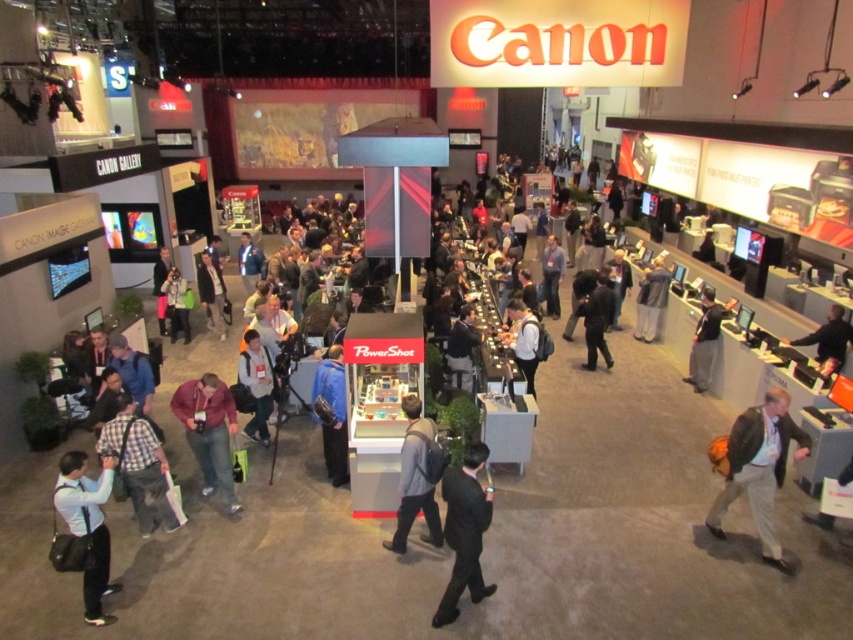
Question: Does black suit at center appear on the left side of gray fabric backpack at center?

Choices:
 (A) yes
 (B) no

Answer: (B)

Question: Does light gray fabric jacket at center have a greater width compared to dark gray backpack at center?

Choices:
 (A) no
 (B) yes

Answer: (B)

Question: In this image, where is plaid shirt at lower left located relative to dark gray fabric jacket at lower right?

Choices:
 (A) above
 (B) below

Answer: (B)

Question: Which point appears farthest from the camera in this image?

Choices:
 (A) (201, 252)
 (B) (529, 362)

Answer: (A)

Question: Which object appears closest to the camera in this image?

Choices:
 (A) black fabric jacket at center
 (B) gray fabric backpack at center

Answer: (B)

Question: Which is farther from the black suit at center?

Choices:
 (A) black fabric shirt at center
 (B) light gray fabric jacket at center
 (C) light blue shirt at lower left
 (D) plaid shirt at lower left

Answer: (A)